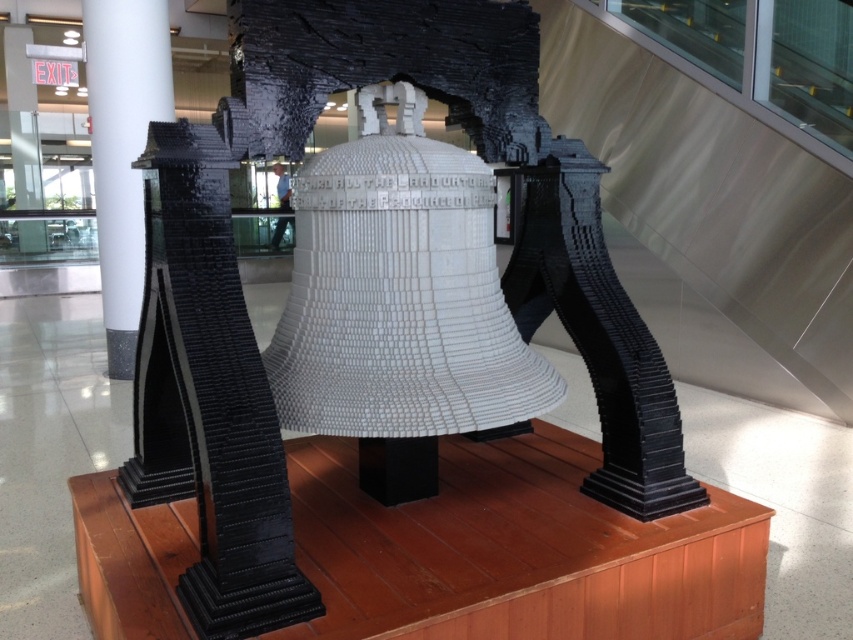
You are standing in front of the LEGO model of the Liberty Bell. There are two points marked in the image. The first point is at coordinate point (206, 355), and the second point is at coordinate point (113, 204). Which point is closer to you?

Point (206, 355) is in front of point (113, 204), so it is closer to you.

You are standing in front of a LEGO model of the Liberty Bell. The model is displayed on a wooden platform. There is a point marked at coordinates (x=244, y=304). What object is located at this point?

The point at coordinates (x=244, y=304) marks the white LEGO bell at center.